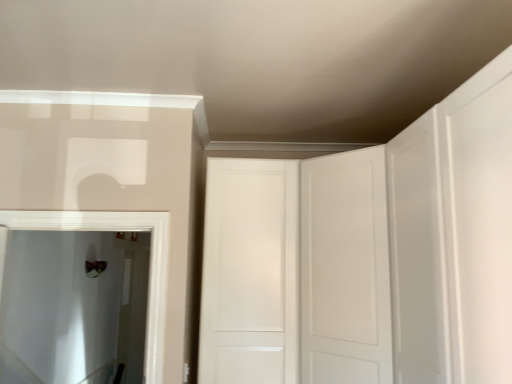
Question: Should I look upward or downward to see white matte door at center?

Choices:
 (A) down
 (B) up

Answer: (A)